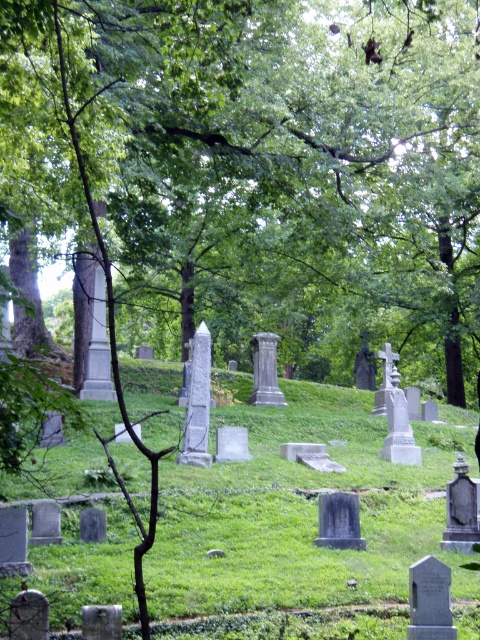
Is point (276, 221) behind point (200, 548)?

Yes, point (276, 221) is farther from viewer.

The image size is (480, 640). What do you see at coordinates (257, 170) in the screenshot? I see `green leafy tree at center` at bounding box center [257, 170].

Identify the location of green leafy tree at center. The width and height of the screenshot is (480, 640). (257, 170).

The width and height of the screenshot is (480, 640). Find the location of `green leafy tree at center`. green leafy tree at center is located at coordinates (257, 170).